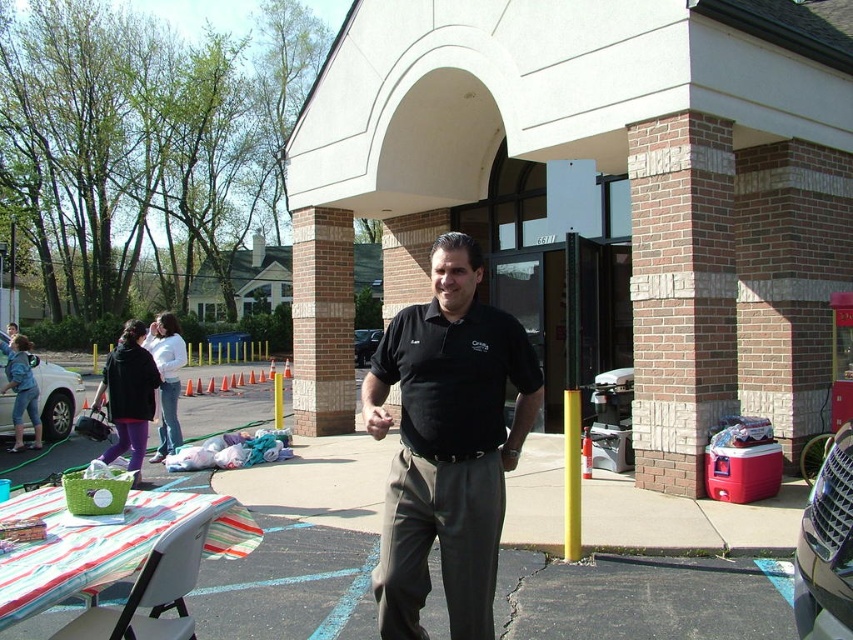
Can you confirm if yellow matte pole at center is thinner than yellow plastic pole at center?

Correct, yellow matte pole at center's width is less than yellow plastic pole at center's.

Does yellow matte pole at center appear on the right side of yellow plastic pole at center?

Correct, you'll find yellow matte pole at center to the right of yellow plastic pole at center.

Which is in front, point (567, 529) or point (276, 388)?

Point (567, 529) is in front.

This screenshot has height=640, width=853. Identify the location of yellow matte pole at center. (x=572, y=401).

Does smooth asphalt pavement at center have a greater height compared to black matte car at center?

No.

Which is above, smooth asphalt pavement at center or black matte car at center?

black matte car at center is higher up.

Who is more distant from viewer, (309, 547) or (357, 342)?

Point (357, 342)

You are a GUI agent. You are given a task and a screenshot of the screen. Output one action in this format:
    pyautogui.click(x=<x>, y=<y>)
    Task: Click on the smooth asphalt pavement at center
    
    Given the screenshot: What is the action you would take?
    pyautogui.click(x=300, y=547)

Can you confirm if yellow matte pole at center is positioned above white glossy car at lower left?

Yes, yellow matte pole at center is above white glossy car at lower left.

Where is `yellow matte pole at center`? yellow matte pole at center is located at coordinates (572, 401).